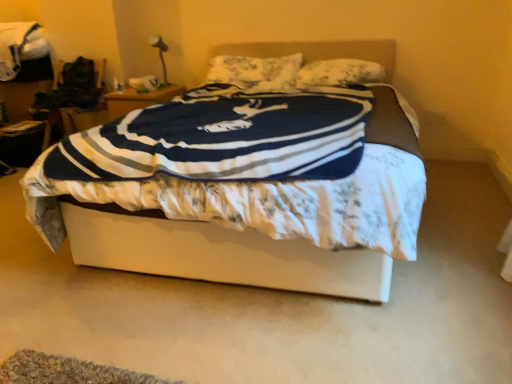
Question: Does white fabric bed at center have a greater height compared to fluffy white pillow at upper center, marked as the first pillow in a right-to-left arrangement?

Choices:
 (A) no
 (B) yes

Answer: (B)

Question: Is white fabric bed at center surrounding fluffy white pillow at upper center, marked as the first pillow in a right-to-left arrangement?

Choices:
 (A) yes
 (B) no

Answer: (A)

Question: Is white fabric bed at center smaller than fluffy white pillow at upper center, marked as the first pillow in a right-to-left arrangement?

Choices:
 (A) yes
 (B) no

Answer: (B)

Question: From the image's perspective, is white fabric bed at center on top of fluffy white pillow at upper center, placed as the 2th pillow when sorted from left to right?

Choices:
 (A) no
 (B) yes

Answer: (A)

Question: Would you say white fabric bed at center is outside fluffy white pillow at upper center, marked as the first pillow in a right-to-left arrangement?

Choices:
 (A) yes
 (B) no

Answer: (A)

Question: Visually, is floral fabric pillow at center, the 2th pillow in the right-to-left sequence, positioned to the left or to the right of fluffy white pillow at upper center, marked as the first pillow in a right-to-left arrangement?

Choices:
 (A) left
 (B) right

Answer: (A)

Question: From the image's perspective, is floral fabric pillow at center, marked as the 1th pillow in a left-to-right arrangement, located above or below fluffy white pillow at upper center, placed as the 2th pillow when sorted from left to right?

Choices:
 (A) above
 (B) below

Answer: (A)

Question: Is point (275, 61) closer or farther from the camera than point (362, 59)?

Choices:
 (A) closer
 (B) farther

Answer: (B)

Question: Considering their positions, is floral fabric pillow at center, the 2th pillow in the right-to-left sequence, located in front of or behind fluffy white pillow at upper center, placed as the 2th pillow when sorted from left to right?

Choices:
 (A) behind
 (B) front

Answer: (A)

Question: From a real-world perspective, is fluffy white pillow at upper center, marked as the first pillow in a right-to-left arrangement, above or below white fabric bed at center?

Choices:
 (A) above
 (B) below

Answer: (A)

Question: In terms of size, does fluffy white pillow at upper center, placed as the 2th pillow when sorted from left to right, appear bigger or smaller than white fabric bed at center?

Choices:
 (A) small
 (B) big

Answer: (A)

Question: Relative to white fabric bed at center, is fluffy white pillow at upper center, placed as the 2th pillow when sorted from left to right, in front or behind?

Choices:
 (A) front
 (B) behind

Answer: (B)

Question: Is point (377, 66) positioned closer to the camera than point (114, 109)?

Choices:
 (A) farther
 (B) closer

Answer: (B)

Question: Looking at their shapes, would you say metallic silver table lamp at upper left is wider or thinner than floral fabric pillow at center, the 2th pillow in the right-to-left sequence?

Choices:
 (A) wide
 (B) thin

Answer: (B)

Question: Is metallic silver table lamp at upper left to the left or to the right of floral fabric pillow at center, the 2th pillow in the right-to-left sequence, in the image?

Choices:
 (A) left
 (B) right

Answer: (A)